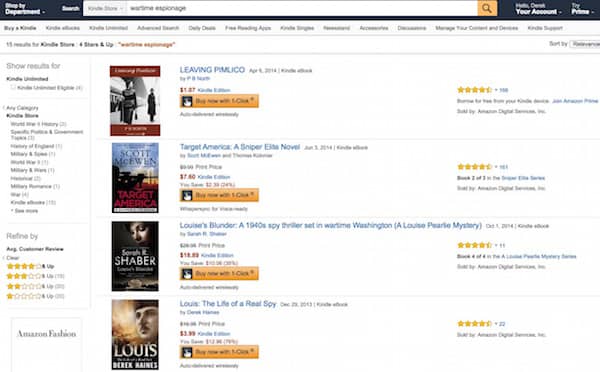
This screenshot has width=600, height=372. Find the location of `book covers`. book covers is located at coordinates (145, 100), (137, 163), (147, 251), (137, 339).